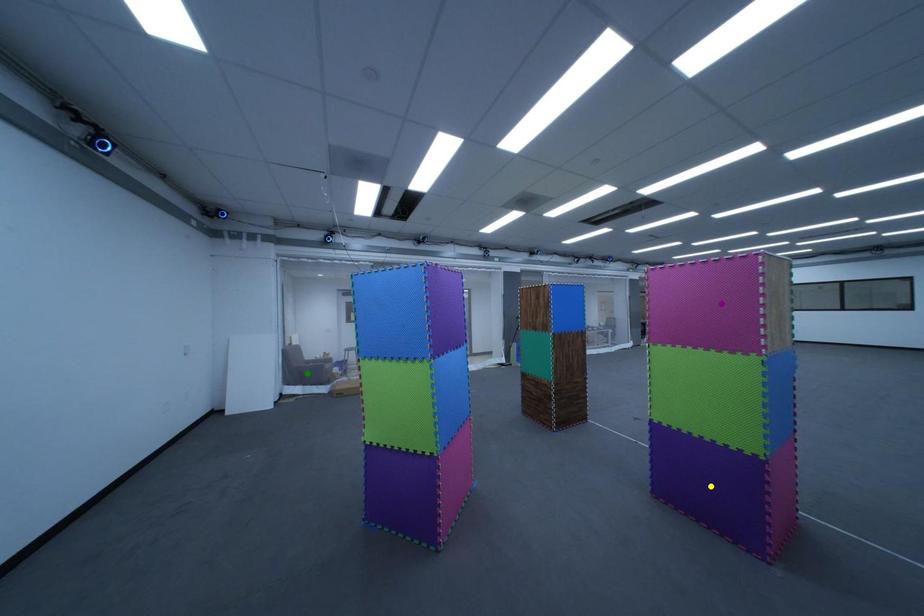
Order these from nearest to farthest:
yellow point | purple point | green point

green point, yellow point, purple point